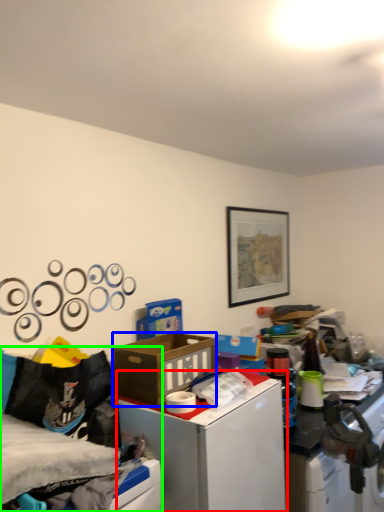
Question: Which object is the closest to the table (highlighted by a red box)? Choose among these: box (highlighted by a blue box) or bed (highlighted by a green box).

Choices:
 (A) box
 (B) bed

Answer: (A)